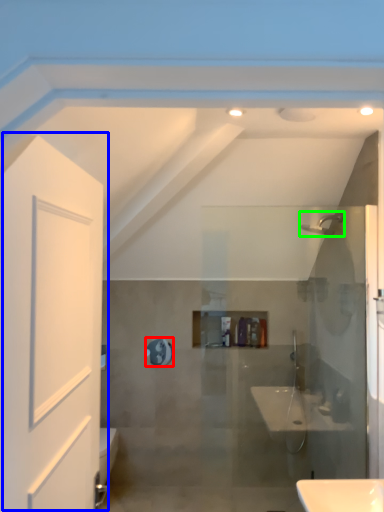
Question: Which object is positioned closest to mirror (highlighted by a red box)? Select from door (highlighted by a blue box) and shower (highlighted by a green box).

Choices:
 (A) door
 (B) shower

Answer: (B)